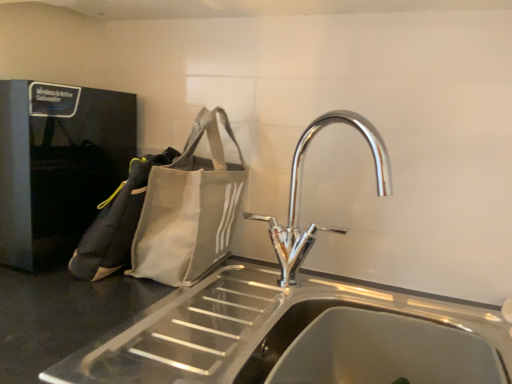
Question: Is chrome metallic tap at center shorter than stainless steel sink at center?

Choices:
 (A) no
 (B) yes

Answer: (A)

Question: Does chrome metallic tap at center have a larger size compared to stainless steel sink at center?

Choices:
 (A) yes
 (B) no

Answer: (B)

Question: Is the depth of chrome metallic tap at center less than that of stainless steel sink at center?

Choices:
 (A) no
 (B) yes

Answer: (A)

Question: Can you confirm if chrome metallic tap at center is thinner than stainless steel sink at center?

Choices:
 (A) no
 (B) yes

Answer: (B)

Question: Does chrome metallic tap at center lie behind stainless steel sink at center?

Choices:
 (A) yes
 (B) no

Answer: (A)

Question: Is chrome metallic tap at center positioned beyond the bounds of stainless steel sink at center?

Choices:
 (A) yes
 (B) no

Answer: (A)

Question: Is white canvas tote bag at left, which is the 1th pouch in left-to-right order, at the back of chrome metallic tap at center?

Choices:
 (A) no
 (B) yes

Answer: (A)

Question: Is white canvas tote bag at left, which is the 1th pouch in left-to-right order, a part of chrome metallic tap at center?

Choices:
 (A) no
 (B) yes

Answer: (A)

Question: Can you confirm if chrome metallic tap at center is thinner than white canvas tote bag at left, which is the 1th pouch in left-to-right order?

Choices:
 (A) no
 (B) yes

Answer: (B)

Question: Is chrome metallic tap at center bigger than white canvas tote bag at left, which is the 1th pouch in left-to-right order?

Choices:
 (A) yes
 (B) no

Answer: (A)

Question: Considering the relative sizes of chrome metallic tap at center and white canvas tote bag at left, which is the 1th pouch in left-to-right order, in the image provided, is chrome metallic tap at center wider than white canvas tote bag at left, which is the 1th pouch in left-to-right order,?

Choices:
 (A) yes
 (B) no

Answer: (B)

Question: Would you say chrome metallic tap at center is a long distance from white canvas tote bag at left, the second pouch positioned from the right?

Choices:
 (A) no
 (B) yes

Answer: (A)

Question: Could chrome metallic tap at center be considered to be inside stainless steel sink at center?

Choices:
 (A) yes
 (B) no

Answer: (B)